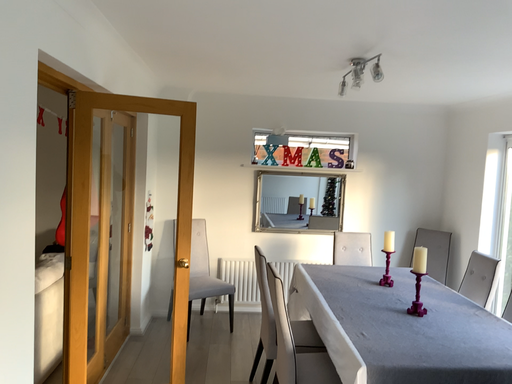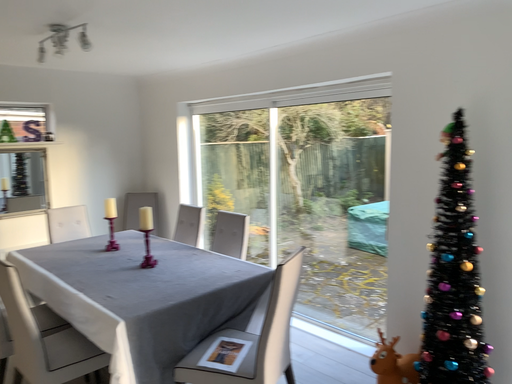
Question: Which way did the camera rotate in the video?

Choices:
 (A) rotated right
 (B) rotated left

Answer: (A)